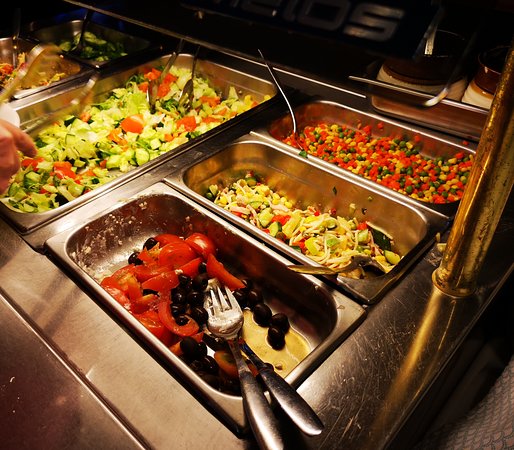
Identify the location of countertop. This screenshot has width=514, height=450. (119, 361).